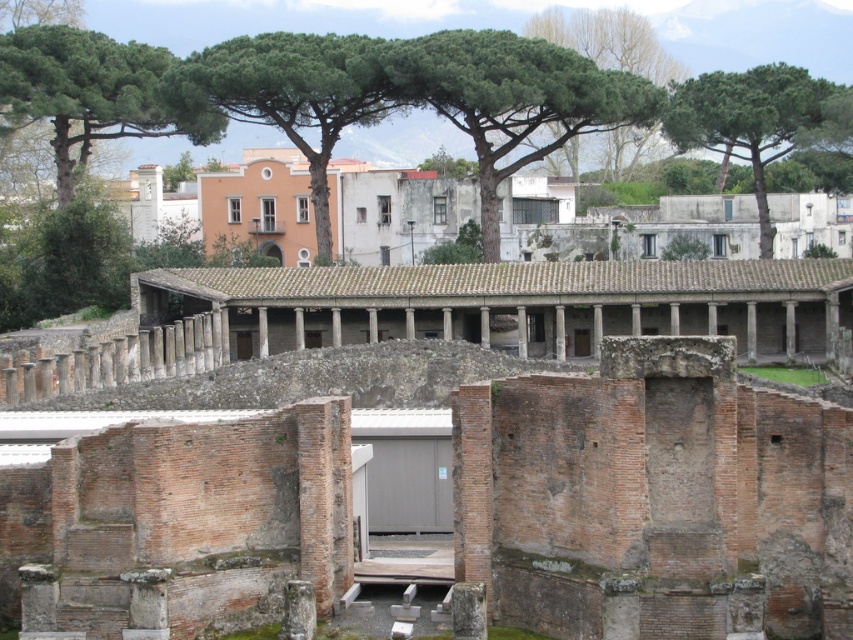
Based on the photo, you are standing at the entrance of the archaeological site and see the green leafy tree at upper center. Based on its position, can you estimate whether it is closer to the exposed brick walls in the foreground or the roofed walkway in the middle ground?

The green leafy tree at upper center is located at point (514, 99), which places it closer to the roofed walkway in the middle ground than the exposed brick walls in the foreground.